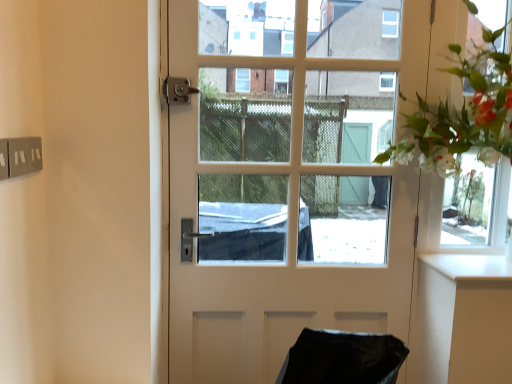
Question: Can you confirm if clear glass window frame at upper right is smaller than white glossy counter top at right?

Choices:
 (A) yes
 (B) no

Answer: (B)

Question: Is the depth of clear glass window frame at upper right greater than that of white glossy counter top at right?

Choices:
 (A) yes
 (B) no

Answer: (A)

Question: Does clear glass window frame at upper right appear on the right side of white glossy counter top at right?

Choices:
 (A) no
 (B) yes

Answer: (B)

Question: Is clear glass window frame at upper right looking in the opposite direction of white glossy counter top at right?

Choices:
 (A) yes
 (B) no

Answer: (B)

Question: Is clear glass window frame at upper right to the left of white glossy counter top at right from the viewer's perspective?

Choices:
 (A) yes
 (B) no

Answer: (B)

Question: Does clear glass window frame at upper right have a greater height compared to white glossy counter top at right?

Choices:
 (A) yes
 (B) no

Answer: (A)

Question: From a real-world perspective, is clear glass window frame at upper right on top of white glossy door at center?

Choices:
 (A) yes
 (B) no

Answer: (A)

Question: Would you consider clear glass window frame at upper right to be distant from white glossy door at center?

Choices:
 (A) no
 (B) yes

Answer: (A)

Question: Is clear glass window frame at upper right thinner than white glossy door at center?

Choices:
 (A) yes
 (B) no

Answer: (A)

Question: From the image's perspective, is clear glass window frame at upper right above white glossy door at center?

Choices:
 (A) no
 (B) yes

Answer: (B)

Question: Is clear glass window frame at upper right looking in the opposite direction of white glossy door at center?

Choices:
 (A) no
 (B) yes

Answer: (A)

Question: Considering the relative positions of clear glass window frame at upper right and white glossy door at center in the image provided, is clear glass window frame at upper right to the right of white glossy door at center from the viewer's perspective?

Choices:
 (A) no
 (B) yes

Answer: (B)

Question: Is white glossy counter top at right wider than clear glass window frame at upper right?

Choices:
 (A) no
 (B) yes

Answer: (B)